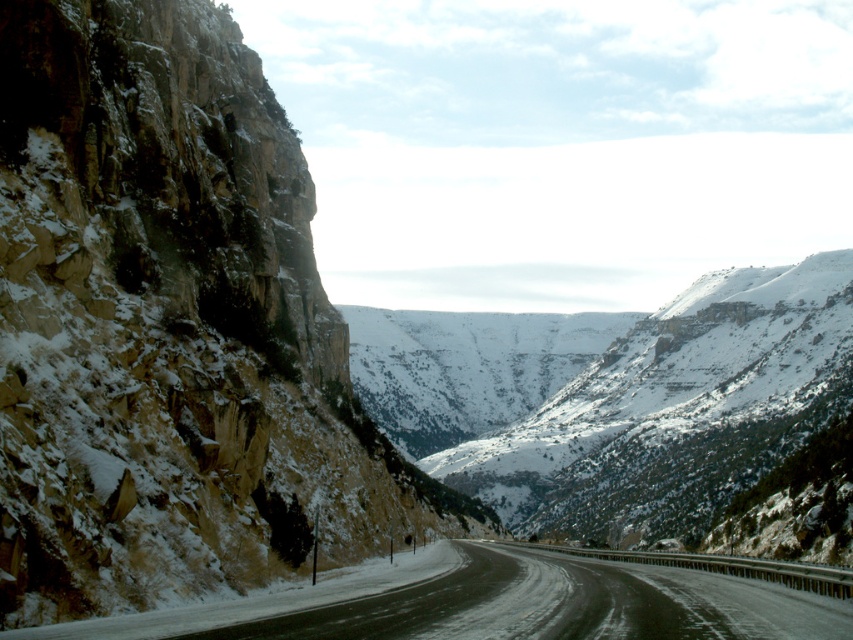
Can you confirm if rugged stone cliff at left is wider than slick asphalt highway at center?

In fact, rugged stone cliff at left might be narrower than slick asphalt highway at center.

Can you confirm if rugged stone cliff at left is smaller than slick asphalt highway at center?

No.

At what (x,y) coordinates should I click in order to perform the action: click on rugged stone cliff at left. Please return your answer as a coordinate pair (x, y). Image resolution: width=853 pixels, height=640 pixels. Looking at the image, I should click on (170, 326).

Where is `rugged stone cliff at left`? rugged stone cliff at left is located at coordinates (170, 326).